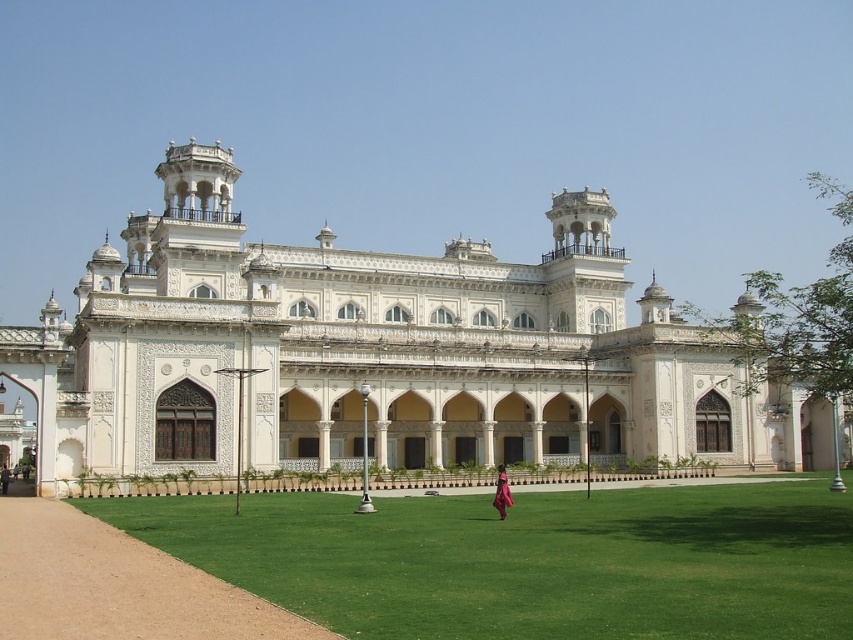
Image resolution: width=853 pixels, height=640 pixels. What do you see at coordinates (378, 353) in the screenshot?
I see `white marble palace at center` at bounding box center [378, 353].

Find the location of a particular element. The height and width of the screenshot is (640, 853). white marble palace at center is located at coordinates (378, 353).

This screenshot has height=640, width=853. I want to click on white marble palace at center, so click(378, 353).

Which is below, green grass at center or pink silk dress at center?

Positioned lower is pink silk dress at center.

Which is more to the right, green grass at center or pink silk dress at center?

pink silk dress at center is more to the right.

Is point (610, 572) farther from viewer compared to point (508, 502)?

No, (610, 572) is in front of (508, 502).

This screenshot has height=640, width=853. What are the coordinates of `green grass at center` in the screenshot? It's located at (527, 561).

Does point (25, 365) lie in front of point (207, 515)?

No, (25, 365) is further to viewer.

Describe the element at coordinates (378, 353) in the screenshot. The image size is (853, 640). I see `white marble palace at center` at that location.

Where is `white marble palace at center`? white marble palace at center is located at coordinates (378, 353).